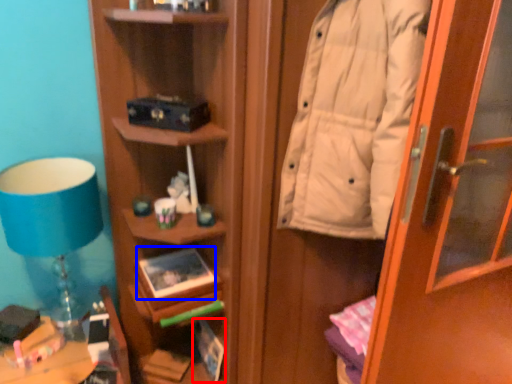
Question: Which of the following is the farthest to the observer, book (highlighted by a red box) or book (highlighted by a blue box)?

Choices:
 (A) book
 (B) book

Answer: (A)